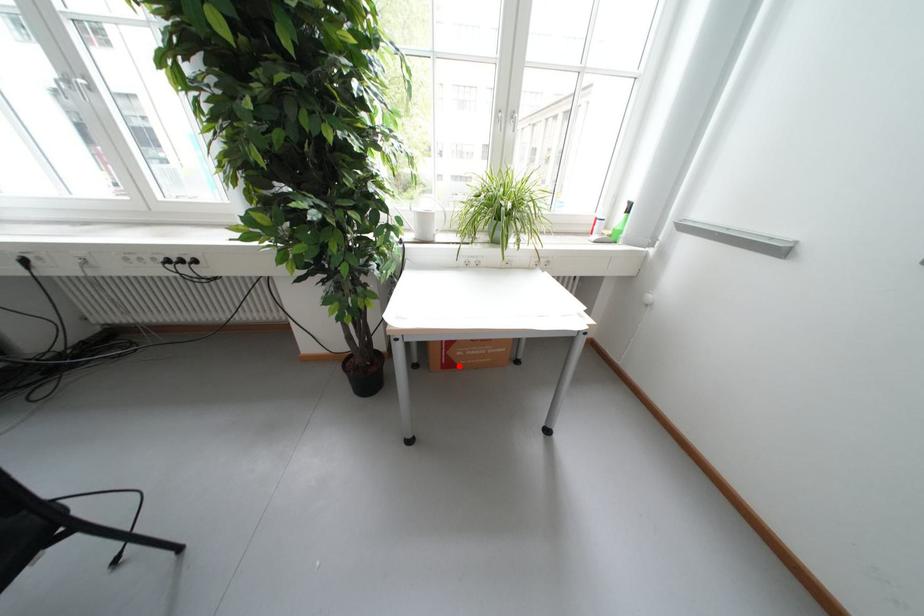
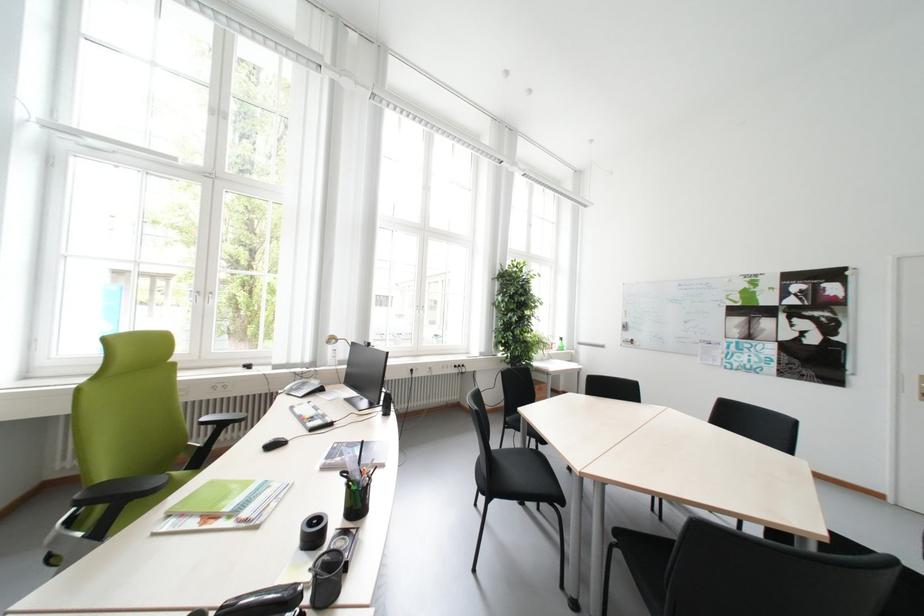
Question: I am providing you with two images of the same scene from different viewpoints. A red point is marked on the first image. Can you still see the location of the red point in image 2?

Choices:
 (A) Yes
 (B) No

Answer: (B)